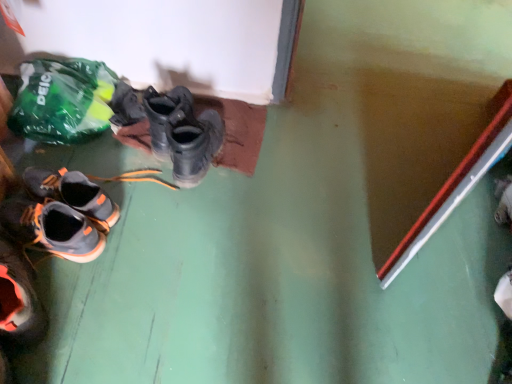
Question: Is gray suede shoes at lower left taller than matte black boots at center?

Choices:
 (A) yes
 (B) no

Answer: (A)

Question: Is gray suede shoes at lower left aimed at matte black boots at center?

Choices:
 (A) no
 (B) yes

Answer: (A)

Question: From the image's perspective, is gray suede shoes at lower left on matte black boots at center?

Choices:
 (A) no
 (B) yes

Answer: (A)

Question: Considering the relative sizes of gray suede shoes at lower left and matte black boots at center in the image provided, is gray suede shoes at lower left wider than matte black boots at center?

Choices:
 (A) no
 (B) yes

Answer: (B)

Question: From the image's perspective, is gray suede shoes at lower left below matte black boots at center?

Choices:
 (A) no
 (B) yes

Answer: (B)

Question: Relative to matte black boots at center, is green plastic bag at upper left in front or behind?

Choices:
 (A) behind
 (B) front

Answer: (B)

Question: Is green plastic bag at upper left taller or shorter than matte black boots at center?

Choices:
 (A) short
 (B) tall

Answer: (B)

Question: Is green plastic bag at upper left inside the boundaries of matte black boots at center, or outside?

Choices:
 (A) outside
 (B) inside

Answer: (A)

Question: Looking at their shapes, would you say green plastic bag at upper left is wider or thinner than matte black boots at center?

Choices:
 (A) wide
 (B) thin

Answer: (B)

Question: Which is correct: gray suede shoes at lower left is inside matte black boots at center, or outside of it?

Choices:
 (A) inside
 (B) outside

Answer: (B)

Question: Looking at their shapes, would you say gray suede shoes at lower left is wider or thinner than matte black boots at center?

Choices:
 (A) thin
 (B) wide

Answer: (B)

Question: Considering their positions, is gray suede shoes at lower left located in front of or behind matte black boots at center?

Choices:
 (A) front
 (B) behind

Answer: (A)

Question: In terms of size, does gray suede shoes at lower left appear bigger or smaller than matte black boots at center?

Choices:
 (A) big
 (B) small

Answer: (A)

Question: In terms of size, does matte black boots at center appear bigger or smaller than gray suede shoes at lower left?

Choices:
 (A) small
 (B) big

Answer: (A)

Question: Relative to gray suede shoes at lower left, is matte black boots at center in front or behind?

Choices:
 (A) behind
 (B) front

Answer: (A)